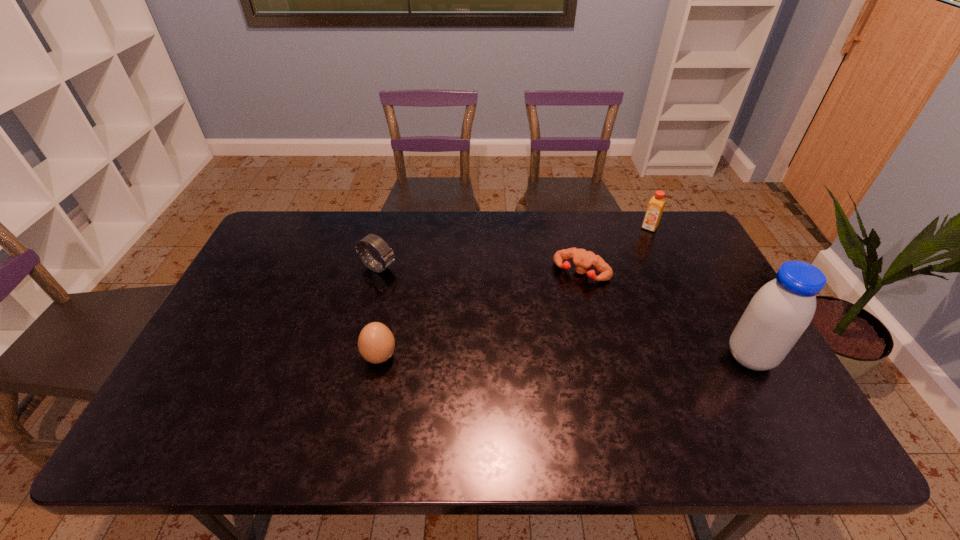
This screenshot has width=960, height=540. Identify the location of soya milk situated at the right edge. (778, 314).

In order to click on orange juice present at the right edge in this screenshot , I will do `click(656, 205)`.

What are the coordinates of `object positioned at the far right corner` in the screenshot? It's located at (656, 205).

This screenshot has height=540, width=960. Find the location of `free space at the far edge of the desktop`. free space at the far edge of the desktop is located at coordinates 620,226.

I want to click on vacant space at the near edge of the desktop, so click(300, 406).

Where is `free space at the right edge of the desktop`? free space at the right edge of the desktop is located at coordinates (727, 353).

The height and width of the screenshot is (540, 960). Find the location of `free location at the far right corner`. free location at the far right corner is located at coordinates (697, 239).

You are a GUI agent. You are given a task and a screenshot of the screen. Output one action in this format:
    pyautogui.click(x=<x>, y=<y>)
    Task: Click on the vacant region between the boiled egg and the watch
    
    Given the screenshot: What is the action you would take?
    pyautogui.click(x=379, y=313)

Find the location of `empty location between the rightmost object and the puncher`. empty location between the rightmost object and the puncher is located at coordinates (666, 315).

I want to click on vacant region between the watch and the farthest object, so click(514, 248).